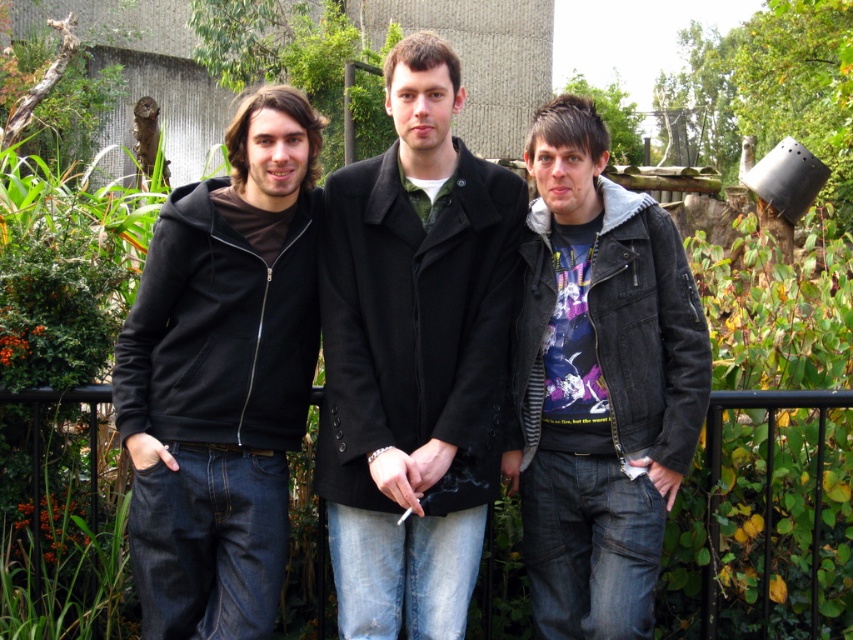
Is black wool coat at center thinner than denim jacket at center?

In fact, black wool coat at center might be wider than denim jacket at center.

Can you confirm if black wool coat at center is bigger than denim jacket at center?

Indeed, black wool coat at center has a larger size compared to denim jacket at center.

What do you see at coordinates (415, 356) in the screenshot? The width and height of the screenshot is (853, 640). I see `black wool coat at center` at bounding box center [415, 356].

The height and width of the screenshot is (640, 853). Find the location of `black wool coat at center`. black wool coat at center is located at coordinates (415, 356).

Does black wool coat at center have a greater width compared to black metal fence at center?

Yes, black wool coat at center is wider than black metal fence at center.

Is point (430, 612) in front of point (804, 394)?

Yes.

Where is `black wool coat at center`? black wool coat at center is located at coordinates (415, 356).

Locate an element on the screen. black wool coat at center is located at coordinates (415, 356).

Consider the image. Is denim jacket at center positioned at the back of black metal fence at center?

No.

Does point (569, 291) lie in front of point (706, 529)?

That is True.

Is point (660, 216) farther from camera compared to point (90, 509)?

No, (660, 216) is closer to viewer.

What are the coordinates of `denim jacket at center` in the screenshot? It's located at (599, 384).